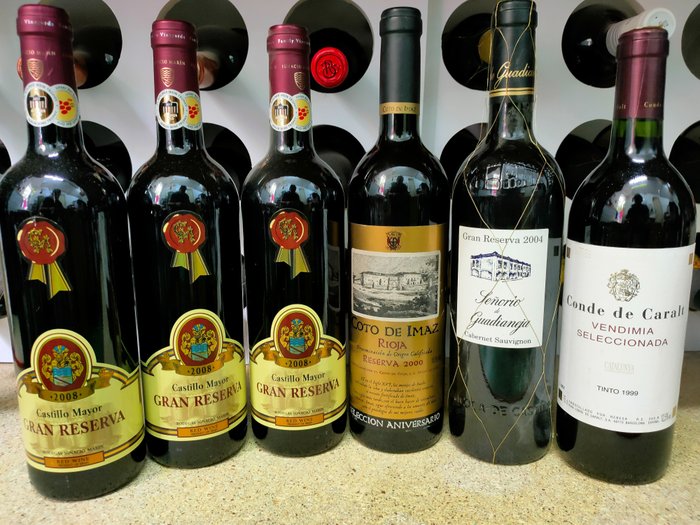
The width and height of the screenshot is (700, 525). I want to click on bottle, so click(617, 452).